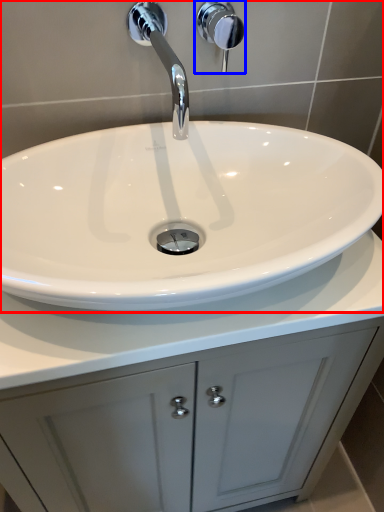
Question: Which point is further to the camera, sink (highlighted by a red box) or shower (highlighted by a blue box)?

Choices:
 (A) sink
 (B) shower

Answer: (B)